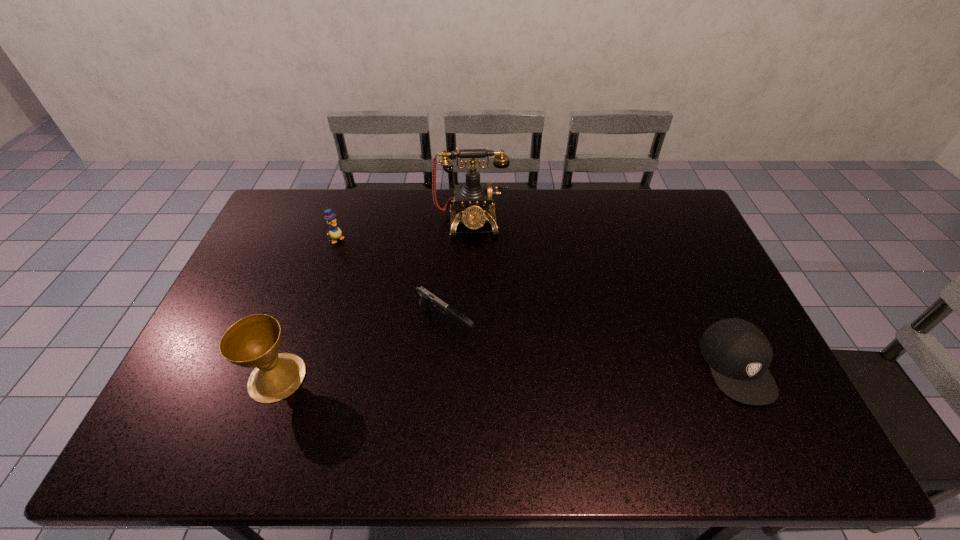
At what (x,y) coordinates should I click in order to perform the action: click on vacant space on the desktop that is between the fourth shortest object and the rightmost object and is positioned on the face of the duckling, where the monocle is placed. Please return your answer as a coordinate pair (x, y). The image size is (960, 540). Looking at the image, I should click on (482, 372).

I want to click on vacant space on the desktop that is between the second tallest object and the rightmost object and is positioned at the muzzle end of the shortest object, so click(514, 371).

Where is `vacant spot on the desktop that is between the chalice and the cap and is positioned on the front of the telephone, featuring the rotary dial`? This screenshot has height=540, width=960. vacant spot on the desktop that is between the chalice and the cap and is positioned on the front of the telephone, featuring the rotary dial is located at coordinates (478, 372).